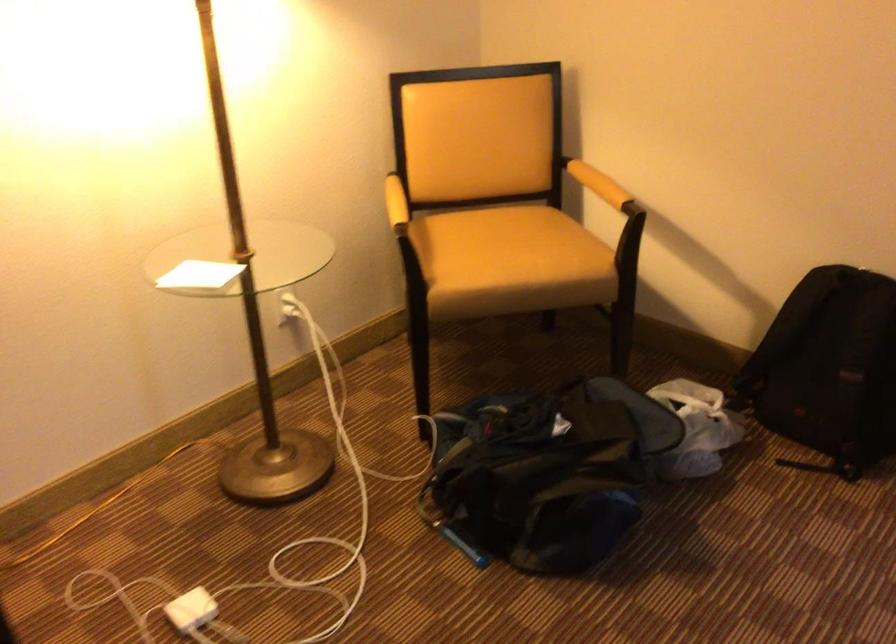
Where is `black backpack`? The image size is (896, 644). black backpack is located at coordinates (829, 368).